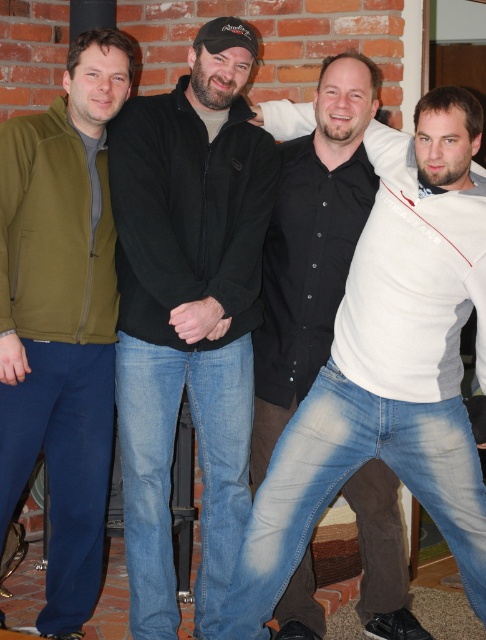
Between black matte jacket at center and olive green fleece jacket at left, which one appears on the left side from the viewer's perspective?

olive green fleece jacket at left is more to the left.

Consider the image. How much distance is there between black matte jacket at center and olive green fleece jacket at left?

The distance of black matte jacket at center from olive green fleece jacket at left is 12.45 inches.

Between point (175, 106) and point (77, 609), which one is positioned in front?

Point (175, 106) is in front.

Find the location of `black matte jacket at center`. black matte jacket at center is located at coordinates (188, 310).

Does black matte jacket at center appear on the right side of white matte shirt at center?

No, black matte jacket at center is not to the right of white matte shirt at center.

Between point (168, 172) and point (312, 228), which one is positioned behind?

Positioned behind is point (312, 228).

You are a GUI agent. You are given a task and a screenshot of the screen. Output one action in this format:
    pyautogui.click(x=<x>, y=<y>)
    Task: Click on the black matte jacket at center
    Image resolution: width=486 pixels, height=640 pixels.
    Given the screenshot: What is the action you would take?
    pyautogui.click(x=188, y=310)

Does olive green fleece jacket at left appear on the left side of white matte shirt at center?

Yes, olive green fleece jacket at left is to the left of white matte shirt at center.

Which is behind, point (101, 80) or point (353, 97)?

The point (353, 97) is more distant.

Where is `olive green fleece jacket at left`? This screenshot has height=640, width=486. olive green fleece jacket at left is located at coordinates (62, 317).